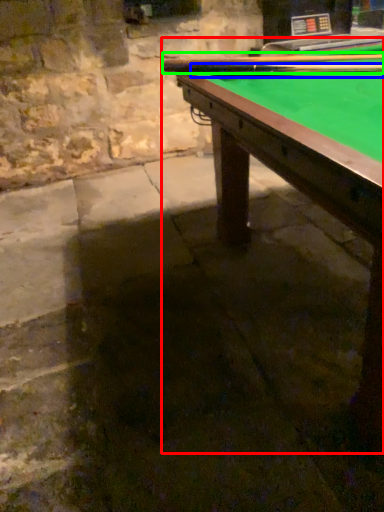
Question: Which object is the closest to the billiard table (highlighted by a red box)? Choose among these: cue (highlighted by a blue box) or cue (highlighted by a green box).

Choices:
 (A) cue
 (B) cue

Answer: (A)